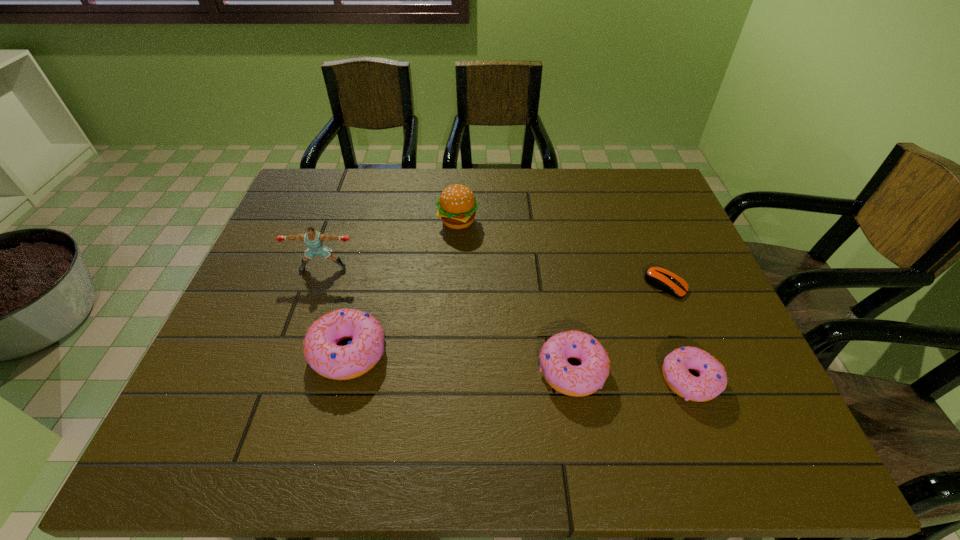
Identify the location of vacant area between the leftmost doughnut and the second tallest object. The width and height of the screenshot is (960, 540). click(403, 287).

Where is `empty location between the fifth tallest object and the leftmost doughnut`? empty location between the fifth tallest object and the leftmost doughnut is located at coordinates (519, 366).

The height and width of the screenshot is (540, 960). What are the coordinates of `vacant space that is in between the third shortest object and the leftmost doughnut` in the screenshot? It's located at (461, 361).

You are a GUI agent. You are given a task and a screenshot of the screen. Output one action in this format:
    pyautogui.click(x=<x>, y=<y>)
    Task: Click on the free spot between the leftmost doughnut and the shortest doughnut
    The image size is (960, 540).
    Given the screenshot: What is the action you would take?
    pyautogui.click(x=519, y=366)

You are a GUI agent. You are given a task and a screenshot of the screen. Output one action in this format:
    pyautogui.click(x=<x>, y=<y>)
    Task: Click on the third closest object to the leftmost doughnut
    Image resolution: width=960 pixels, height=540 pixels.
    Given the screenshot: What is the action you would take?
    pyautogui.click(x=583, y=380)

Find the location of a particular element. Image resolution: width=960 pixels, height=540 pixels. the fourth closest object to the leftmost doughnut is located at coordinates (712, 380).

Identify which doughnut is located as the second nearest to the second shortest doughnut. Please provide its 2D coordinates. Your answer should be formatted as a tuple, i.e. [(x, y)], where the tuple contains the x and y coordinates of a point satisfying the conditions above.

[(321, 351)]

Choose which doughnut is the second nearest neighbor to the fourth object from left to right. Please provide its 2D coordinates. Your answer should be formatted as a tuple, i.e. [(x, y)], where the tuple contains the x and y coordinates of a point satisfying the conditions above.

[(321, 351)]

Where is `free space that satisfies the following two spatial constraints: 1. on the front-facing side of the puncher; 2. on the left side of the computer mouse`? free space that satisfies the following two spatial constraints: 1. on the front-facing side of the puncher; 2. on the left side of the computer mouse is located at coordinates (318, 285).

Find the location of a particular element. free space that satisfies the following two spatial constraints: 1. on the front-facing side of the tallest object; 2. on the left side of the shortest object is located at coordinates [318, 285].